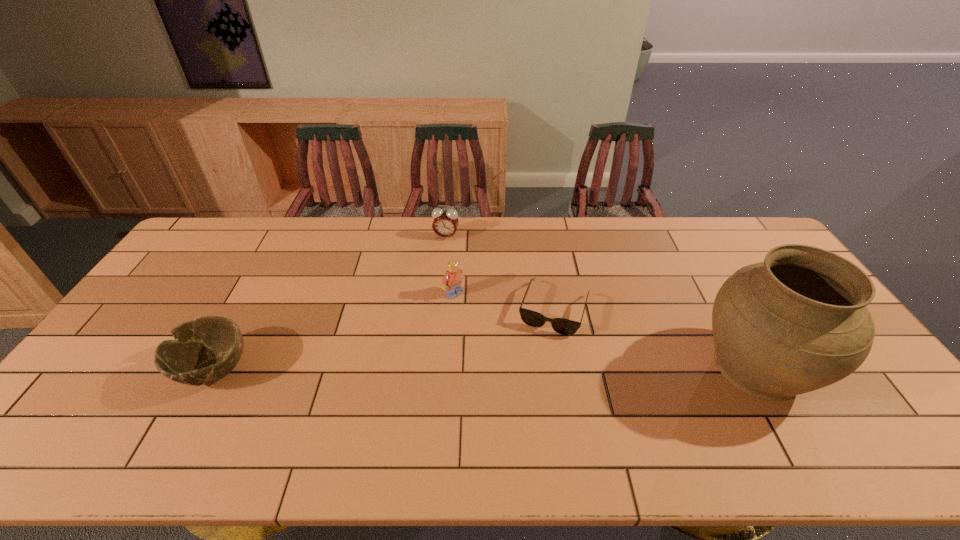
Find the location of a particular element. free space between the urn and the alarm clock is located at coordinates (602, 302).

Locate an element on the screen. This screenshot has width=960, height=540. unoccupied position between the sunglasses and the leftmost object is located at coordinates (384, 339).

I want to click on vacant area that lies between the Lego and the fourth object from left to right, so click(504, 301).

This screenshot has width=960, height=540. In order to click on vacant point located between the bowl and the second object from right to left in this screenshot , I will do `click(384, 339)`.

Locate which object is the fourth closest to the urn. Please provide its 2D coordinates. Your answer should be formatted as a tuple, i.e. [(x, y)], where the tuple contains the x and y coordinates of a point satisfying the conditions above.

[(204, 350)]

Select which object appears as the closest to the rightmost object. Please provide its 2D coordinates. Your answer should be formatted as a tuple, i.e. [(x, y)], where the tuple contains the x and y coordinates of a point satisfying the conditions above.

[(562, 326)]

At what (x,y) coordinates should I click in order to perform the action: click on vacant region that satisfies the following two spatial constraints: 1. on the front side of the Lego; 2. on the left side of the fourth object from left to right. Please return your answer as a coordinate pair (x, y). Looking at the image, I should click on (453, 309).

Find the location of a particular element. vacant space that satisfies the following two spatial constraints: 1. on the front side of the Lego; 2. on the left side of the fourth object from left to right is located at coordinates click(x=453, y=309).

You are a GUI agent. You are given a task and a screenshot of the screen. Output one action in this format:
    pyautogui.click(x=<x>, y=<y>)
    Task: Click on the free space that satisfies the following two spatial constraints: 1. on the front side of the farthest object; 2. on the left side of the rightmost object
    Image resolution: width=960 pixels, height=540 pixels.
    Given the screenshot: What is the action you would take?
    pyautogui.click(x=434, y=367)

I want to click on vacant region that satisfies the following two spatial constraints: 1. on the front side of the Lego; 2. on the left side of the rightmost object, so click(449, 367).